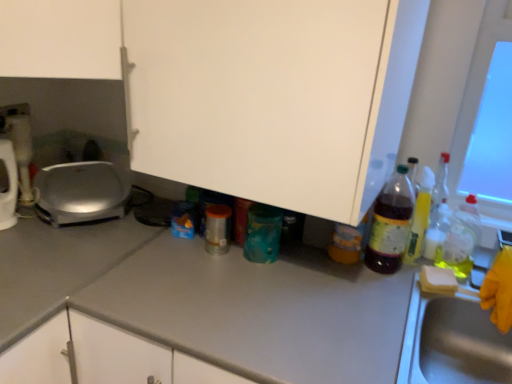
This screenshot has height=384, width=512. In order to click on free region under white matte cabinet at center (from a real-world perspective) in this screenshot , I will do `click(256, 264)`.